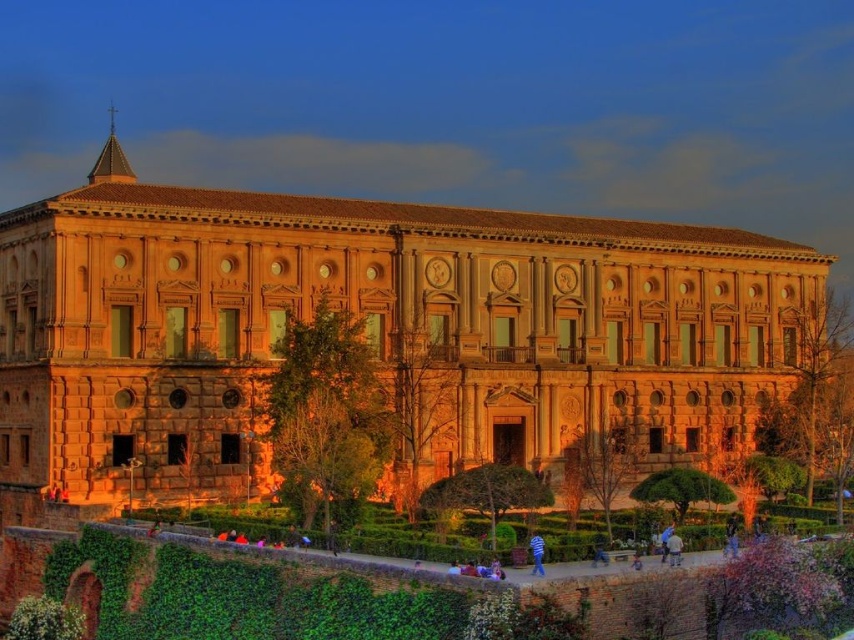
You are a visitor standing in the park and see the brown stone building at center and the blue striped shirt at lower center. Which object is located to the right of the other?

The blue striped shirt at lower center is located to the right of the brown stone building at center.